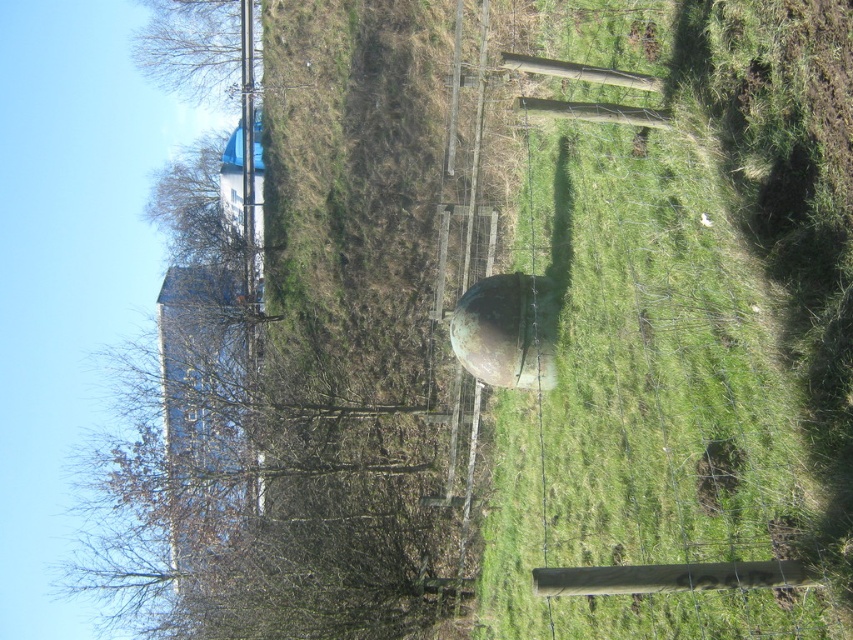
Consider the image. You are a landscape architect planning to install a new tree in the green grassy field at center. Considering the height of the green matte water tower at center, will the tree need to be pruned to avoid blocking sunlight if it grows to the same height as the field?

The green grassy field at center is taller than the green matte water tower at center, so if the tree grows to the same height as the field, it would surpass the water tower and likely block sunlight. Pruning may be necessary to maintain adequate light penetration.

Consider the image. You are standing in the outdoor rural scene and want to walk towards the green matte water tower at center. Which direction should you move relative to the green grassy field at center?

Since the green grassy field at center is closer to the viewer than the green matte water tower at center, you should move away from the green grassy field at center to reach the green matte water tower at center.